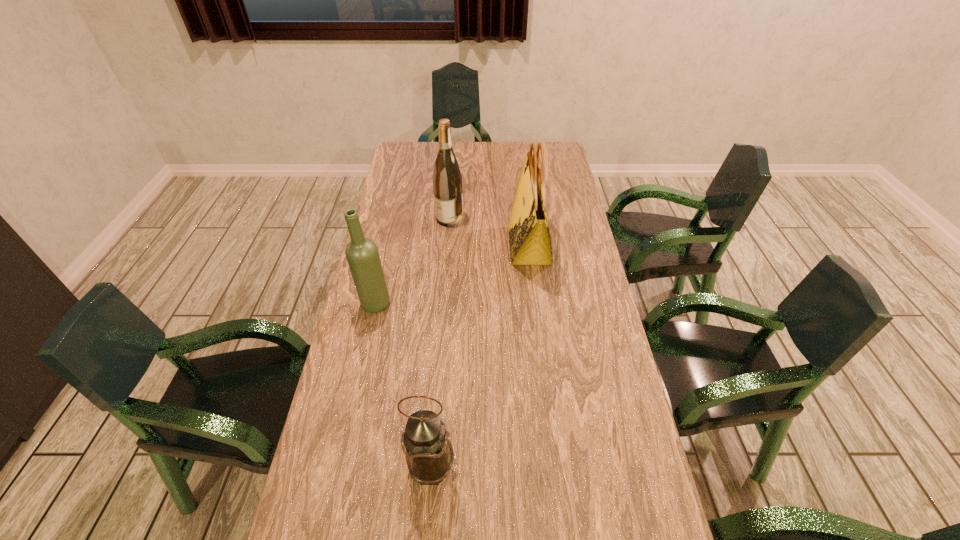
The width and height of the screenshot is (960, 540). I want to click on vacant space positioned 0.290m on the right of the oil lamp, so click(x=587, y=467).

Find the location of a particular element. object at the left edge is located at coordinates (362, 255).

The width and height of the screenshot is (960, 540). Identify the location of object at the right edge. (529, 237).

Locate an element on the screen. vacant area at the far edge is located at coordinates (495, 158).

Where is `vacant region at the left edge of the desktop`? vacant region at the left edge of the desktop is located at coordinates (407, 284).

This screenshot has height=540, width=960. In the image, there is a desktop. Identify the location of vacant area at the right edge. (573, 235).

You are a GUI agent. You are given a task and a screenshot of the screen. Output one action in this format:
    pyautogui.click(x=<x>, y=<y>)
    Task: Click on the blank area at the far left corner
    The width and height of the screenshot is (960, 540).
    Given the screenshot: What is the action you would take?
    pyautogui.click(x=418, y=144)

Locate an element on the screen. The image size is (960, 540). empty location between the oil lamp and the farther wine bottle is located at coordinates point(441,343).

Locate an element on the screen. Image resolution: width=960 pixels, height=540 pixels. vacant space that is in between the oil lamp and the left wine bottle is located at coordinates (403, 386).

Locate an element on the screen. vacant space that's between the rightmost object and the oil lamp is located at coordinates (480, 356).